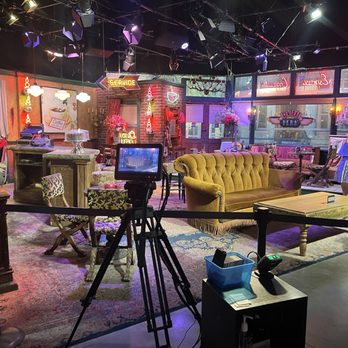
Identify the location of light. (55, 54), (68, 53), (295, 56).